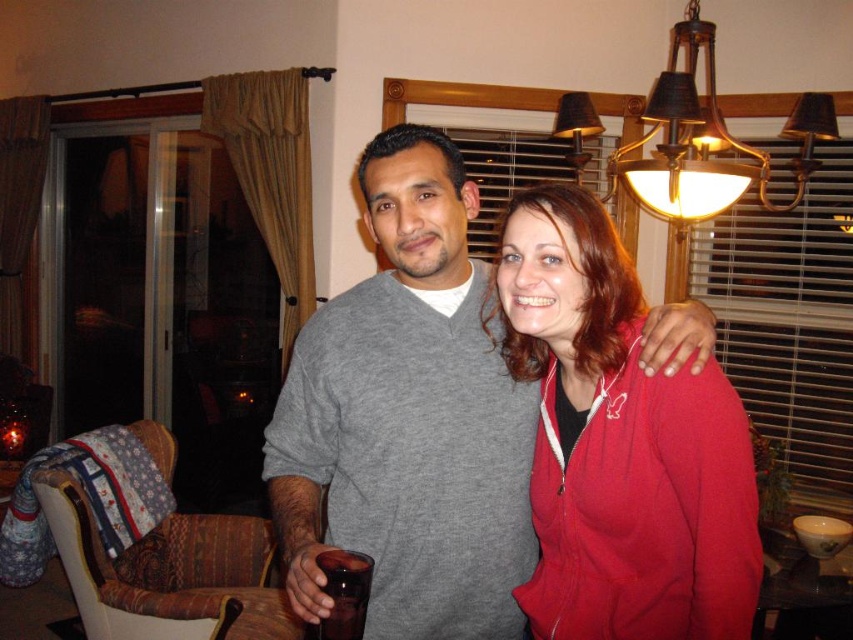
Question: Estimate the real-world distances between objects in this image. Which object is farther from the matte red hoodie at center?

Choices:
 (A) dark brown glass at center
 (B) gray matte sweater at center

Answer: (A)

Question: Which object is the closest to the dark brown glass at center?

Choices:
 (A) matte red hoodie at center
 (B) gray matte sweater at center

Answer: (B)

Question: Observing the image, what is the correct spatial positioning of gray matte sweater at center in reference to matte red hoodie at center?

Choices:
 (A) right
 (B) left

Answer: (B)

Question: Which point appears closest to the camera in this image?

Choices:
 (A) (384, 189)
 (B) (350, 554)
 (C) (630, 372)

Answer: (B)

Question: Does matte red hoodie at center have a greater width compared to dark brown glass at center?

Choices:
 (A) no
 (B) yes

Answer: (B)

Question: Can you confirm if gray matte sweater at center is positioned to the right of dark brown glass at center?

Choices:
 (A) yes
 (B) no

Answer: (A)